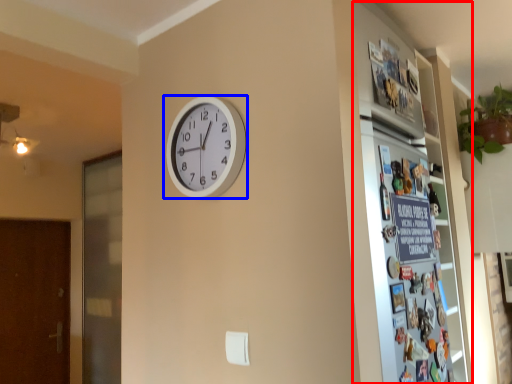
Question: Which object appears closest to the camera in this image, fridge (highlighted by a red box) or wall clock (highlighted by a blue box)?

Choices:
 (A) fridge
 (B) wall clock

Answer: (A)